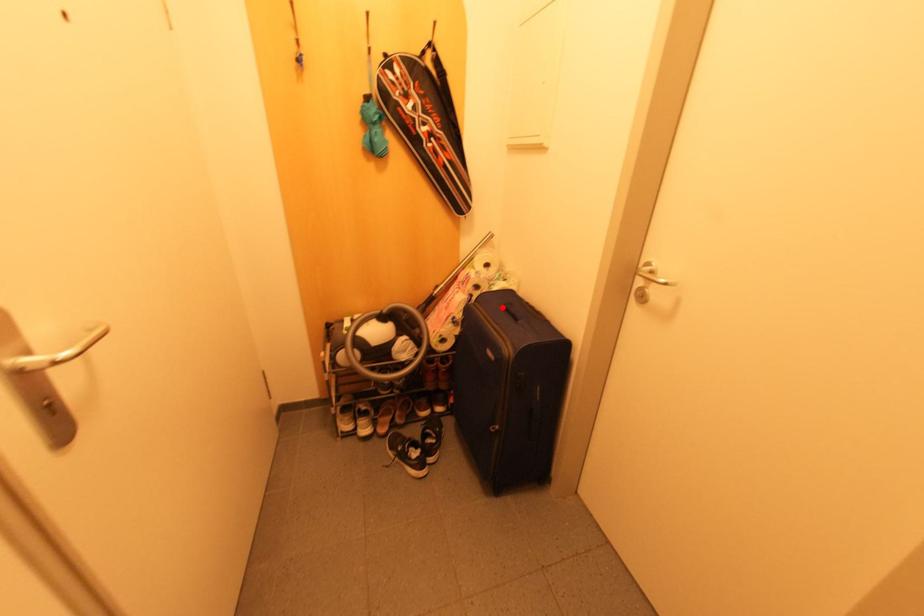
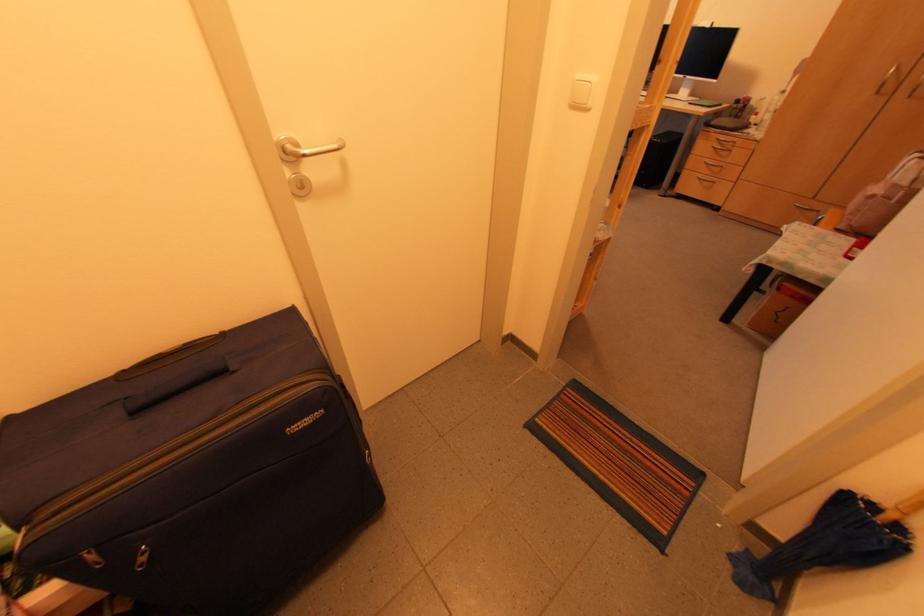
The point at the highlighted location is marked in the first image. Where is the corresponding point in the second image?

(134, 413)